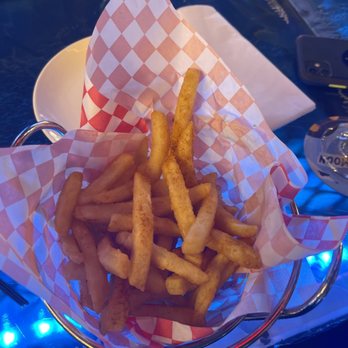
This screenshot has height=348, width=348. I want to click on glass saucer, so click(x=327, y=147).